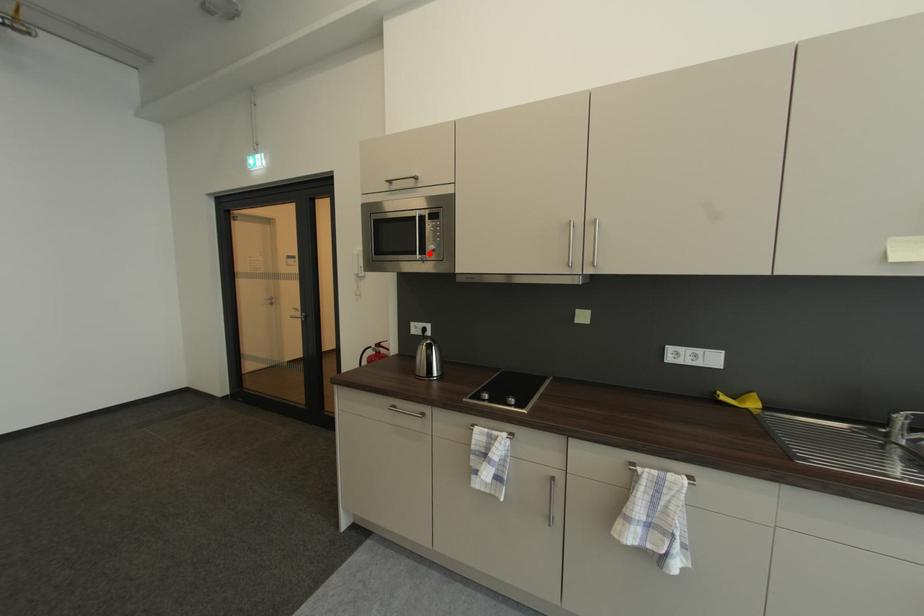
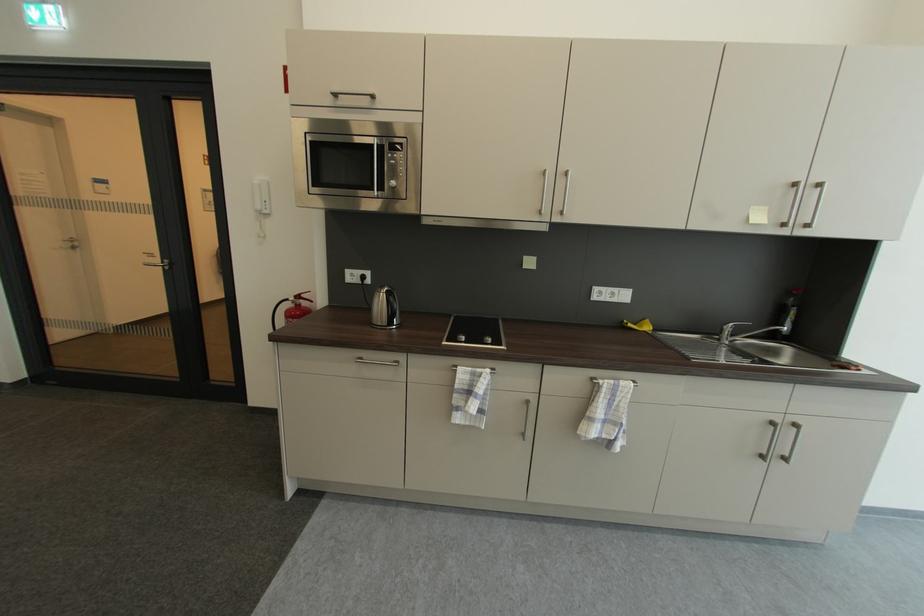
Find the pixel in the second image that matches the highlighted location in the first image.

(387, 188)